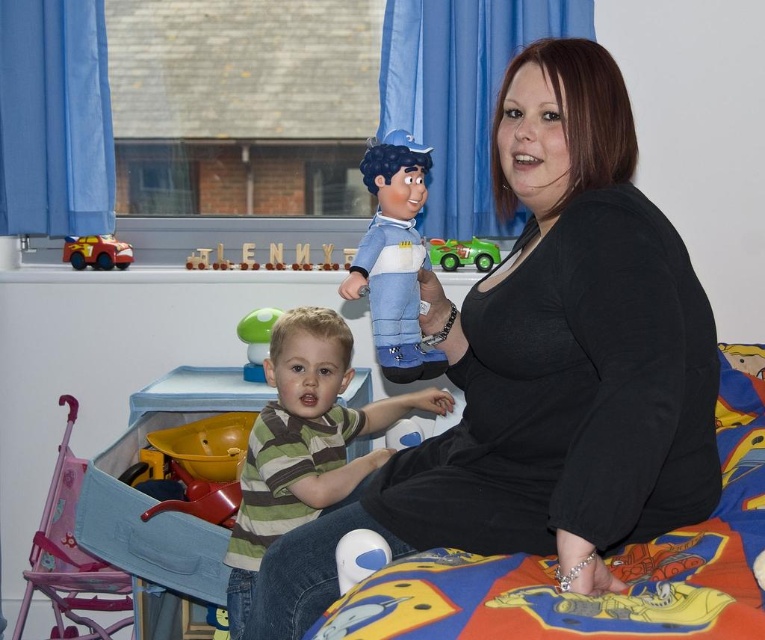
Based on the photo, how much distance is there between black matte shirt at center and matte red car at left?

A distance of 1.45 meters exists between black matte shirt at center and matte red car at left.

Between point (441, 490) and point (129, 256), which one is positioned in front?

Positioned in front is point (441, 490).

Find the location of a particular element. black matte shirt at center is located at coordinates (545, 365).

Consider the image. Is black matte shirt at center to the left of green rubber toy at center from the viewer's perspective?

No, black matte shirt at center is not to the left of green rubber toy at center.

Between point (557, 262) and point (249, 332), which one is positioned in front?

Positioned in front is point (557, 262).

This screenshot has width=765, height=640. I want to click on black matte shirt at center, so click(545, 365).

Who is more distant from viewer, (112, 241) or (259, 346)?

Point (112, 241)

Which is behind, point (96, 244) or point (269, 320)?

Point (96, 244)

You are a GUI agent. You are given a task and a screenshot of the screen. Output one action in this format:
    pyautogui.click(x=<x>, y=<y>)
    Task: Click on the matte red car at left
    
    Given the screenshot: What is the action you would take?
    pyautogui.click(x=96, y=252)